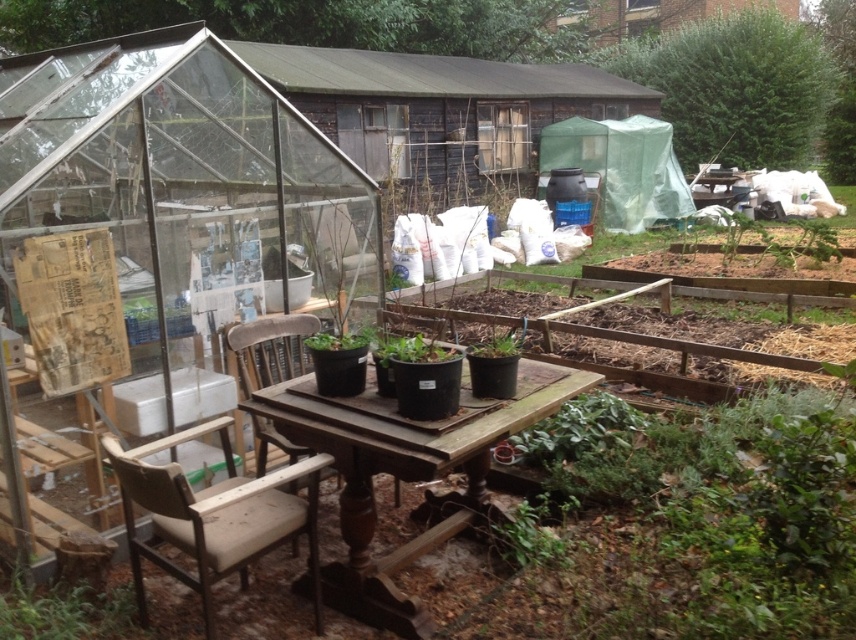
Can you confirm if wooden table at center is wider than brown wooden chair at center?

Correct, the width of wooden table at center exceeds that of brown wooden chair at center.

Is wooden table at center further to the viewer compared to brown wooden chair at center?

No, wooden table at center is in front of brown wooden chair at center.

Which is behind, point (325, 444) or point (265, 339)?

The point (265, 339) is more distant.

You are a GUI agent. You are given a task and a screenshot of the screen. Output one action in this format:
    pyautogui.click(x=<x>, y=<y>)
    Task: Click on the wooden table at center
    The width and height of the screenshot is (856, 640).
    Given the screenshot: What is the action you would take?
    pyautogui.click(x=403, y=472)

Does point (61, 595) come behind point (227, 330)?

No, it is not.

Is green matte plant at lower left taller than brown wooden chair at center?

Incorrect, green matte plant at lower left's height is not larger of brown wooden chair at center's.

Is point (33, 636) positioned in front of point (247, 369)?

Yes, it is.

I want to click on green matte plant at lower left, so click(x=63, y=611).

Is point (76, 582) closer to camera compared to point (492, 353)?

That is False.

Is green matte plant at lower left below green matte pot at center?

Yes, green matte plant at lower left is below green matte pot at center.

What do you see at coordinates (63, 611) in the screenshot? I see `green matte plant at lower left` at bounding box center [63, 611].

This screenshot has width=856, height=640. What are the coordinates of `green matte plant at lower left` in the screenshot? It's located at (63, 611).